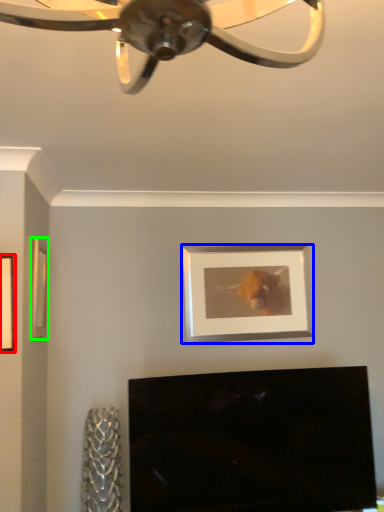
Question: Based on their relative distances, which object is farther from picture frame (highlighted by a red box)? Choose from picture frame (highlighted by a blue box) and picture frame (highlighted by a green box).

Choices:
 (A) picture frame
 (B) picture frame

Answer: (A)